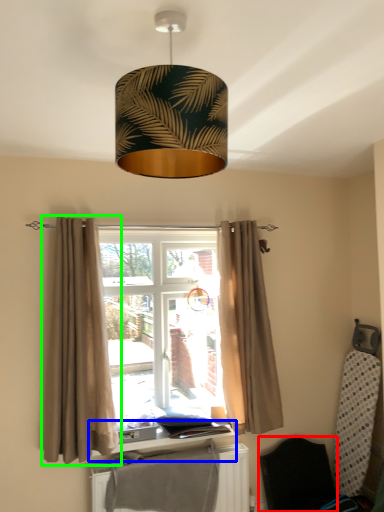
Question: Considering the real-world distances, which object is farthest from folding chair (highlighted by a red box)? window sill (highlighted by a blue box) or curtain (highlighted by a green box)?

Choices:
 (A) window sill
 (B) curtain

Answer: (B)